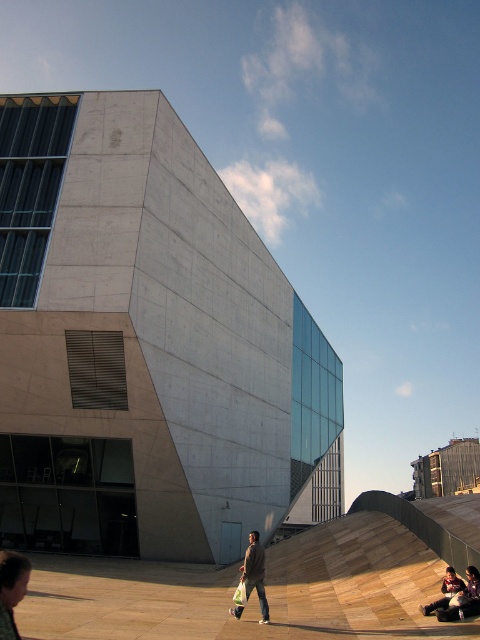
Is light brown leather jacket at lower left positioned in front of denim jacket at center?

Yes.

This screenshot has height=640, width=480. What do you see at coordinates (12, 589) in the screenshot? I see `light brown leather jacket at lower left` at bounding box center [12, 589].

The image size is (480, 640). Find the location of `light brown leather jacket at lower left`. light brown leather jacket at lower left is located at coordinates (12, 589).